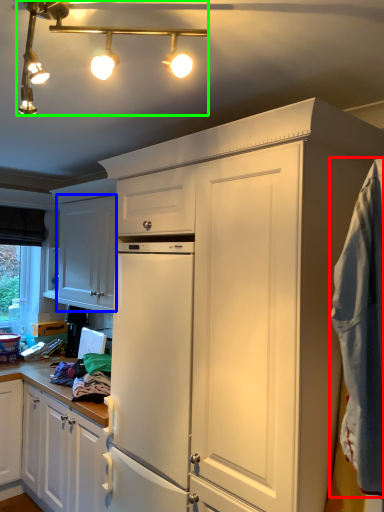
Question: Which is nearer to the blanket (highlighted by a red box)? cabinetry (highlighted by a blue box) or light fixture (highlighted by a green box).

Choices:
 (A) cabinetry
 (B) light fixture

Answer: (B)